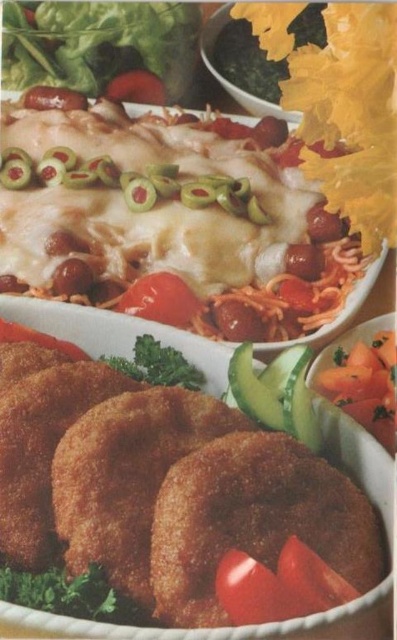
Does green leafy vegetable at upper left appear on the right side of red glossy tomato at center?

Incorrect, green leafy vegetable at upper left is not on the right side of red glossy tomato at center.

Who is more distant from viewer, (175, 28) or (165, 275)?

The point (175, 28) is more distant.

Find the location of a particular element. green leafy vegetable at upper left is located at coordinates (98, 44).